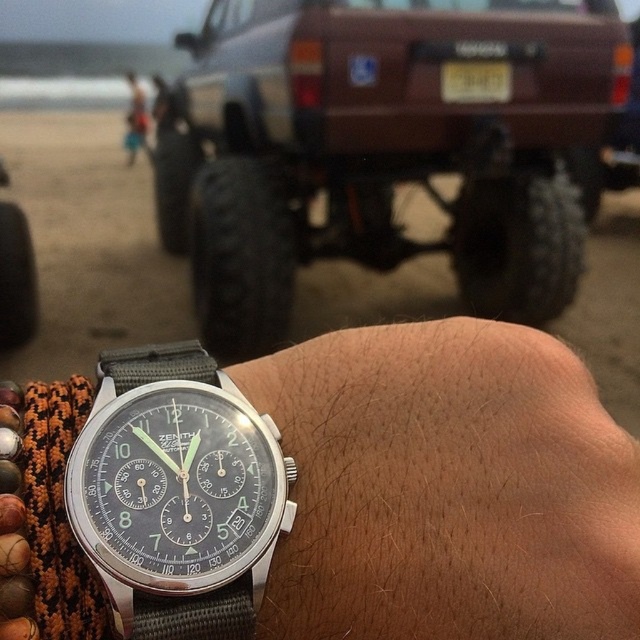
You are standing in the scene and want to take a photo of the brown matte jeep at center. Where should you position yourself to capture it in the frame?

The brown matte jeep at center is located at point (639, 639), so position yourself facing that coordinate to capture it in the frame.

You are a photographer trying to capture the brown matte jeep at center and the yellow matte license plate at center in a single shot. Based on their positions, which object should you focus on first to ensure both are in frame?

The brown matte jeep at center is located below the yellow matte license plate at center, so you should focus on the yellow matte license plate at center first to ensure both are in frame.